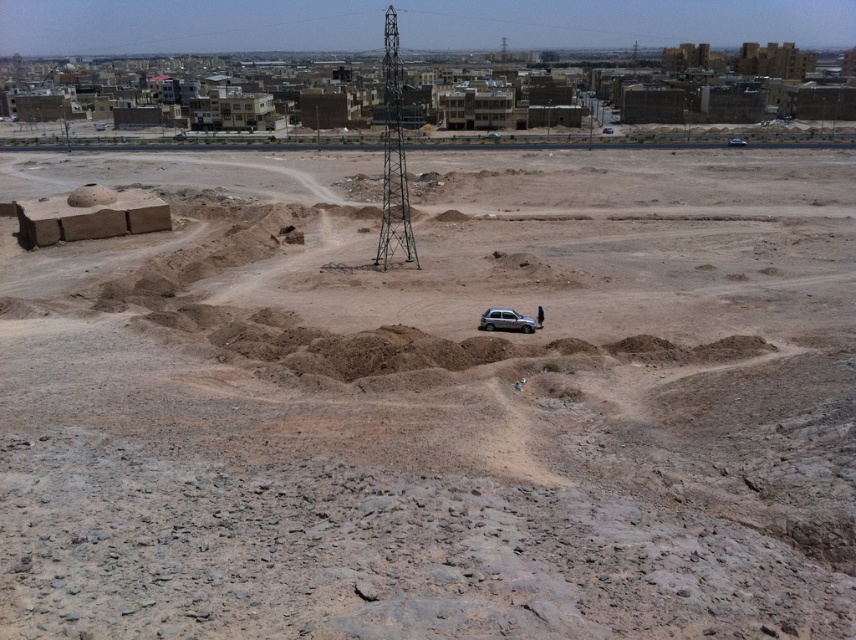
Is metallic structure at center wider than silver metallic car at center?

Correct, the width of metallic structure at center exceeds that of silver metallic car at center.

Is metallic structure at center below silver metallic car at center?

No, metallic structure at center is not below silver metallic car at center.

Measure the distance between metallic structure at center and camera.

A distance of 227.40 feet exists between metallic structure at center and camera.

At what (x,y) coordinates should I click in order to perform the action: click on metallic structure at center. Please return your answer as a coordinate pair (x, y). This screenshot has width=856, height=640. Looking at the image, I should click on (393, 160).